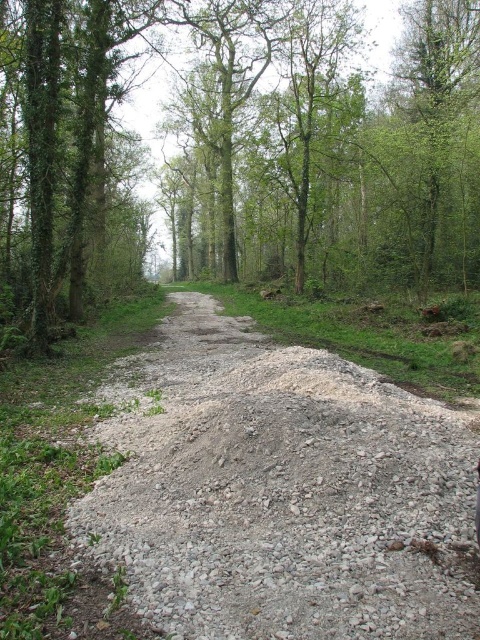
Question: Which of the following is the farthest from the observer?

Choices:
 (A) (476, 56)
 (B) (210, 522)

Answer: (A)

Question: Can you confirm if green leafy tree at center is positioned below gray gravel dirt track at center?

Choices:
 (A) yes
 (B) no

Answer: (B)

Question: Does green leafy tree at center have a smaller size compared to gray gravel dirt track at center?

Choices:
 (A) yes
 (B) no

Answer: (B)

Question: Is green leafy tree at center positioned at the back of gray gravel dirt track at center?

Choices:
 (A) no
 (B) yes

Answer: (B)